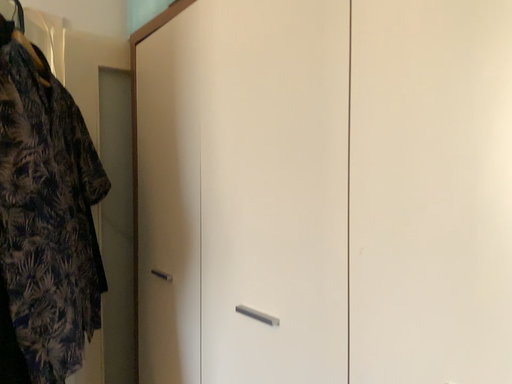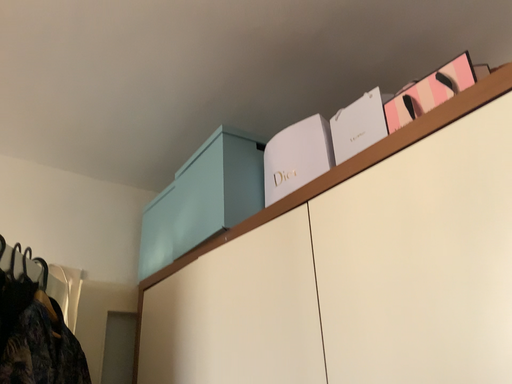
Question: How did the camera likely rotate when shooting the video?

Choices:
 (A) rotated upward
 (B) rotated downward

Answer: (A)